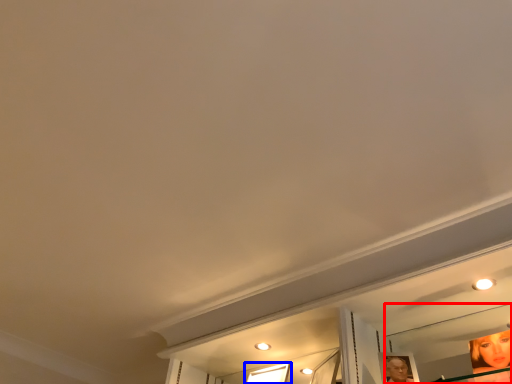
Question: Which of the following is the closest to the observer, mirror (highlighted by a red box) or window (highlighted by a blue box)?

Choices:
 (A) mirror
 (B) window

Answer: (A)